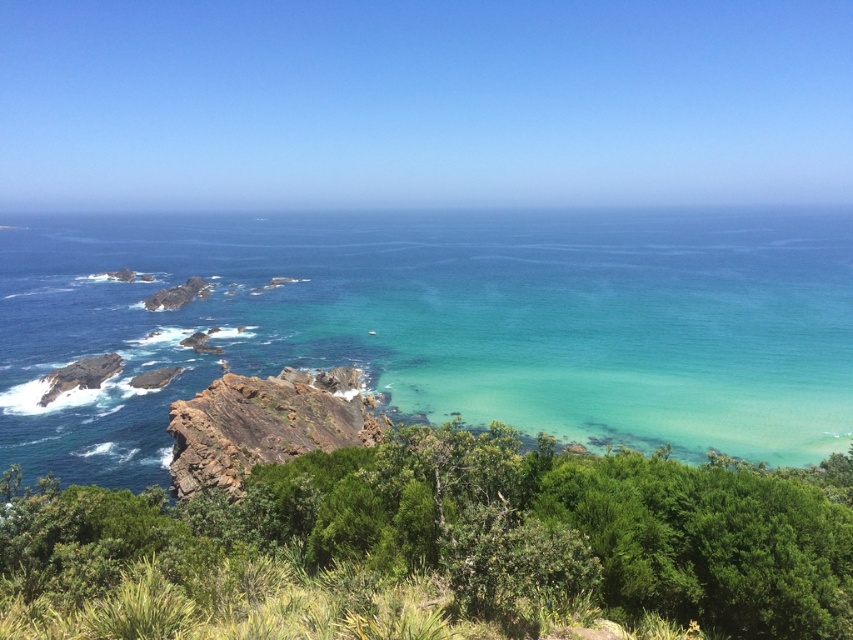
You are a botanist studying plant growth in coastal areas. You observe the green leafy shrubs at lower center and the rusty rock at center. Which object occupies a larger area in the image?

The green leafy shrubs at lower center is bigger than the rusty rock at center, so the shrubs occupy a larger area in the image.

From the picture: You are a marine biologist studying the coastal ecosystem. You need to collect water samples from the clear blue water at center and analyze the rock composition of the rusty rock at center. Given that your boat can only travel in a straight line and has a maximum range of 100 meters, can you reach both locations from your current position without exceeding the boat range?

The distance between the clear blue water at center and the rusty rock at center is 106.42 meters. Since your boat has a maximum range of 100 meters, you cannot reach both locations without exceeding the boat range as the distance between them is greater than the boat can travel.

You are standing on the rocky coastline and want to take a photo of the clear blue water at center and the green leafy shrubs at lower center. Which object will appear closer to the camera in the photo?

The clear blue water at center will appear closer to the camera in the photo because the green leafy shrubs at lower center are positioned behind it.